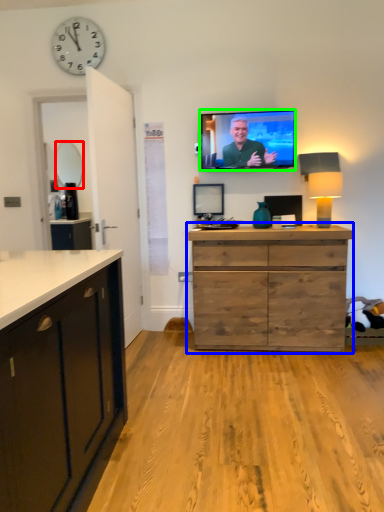
Question: Which is farther away from mirror (highlighted by a red box)? chest of drawers (highlighted by a blue box) or television (highlighted by a green box)?

Choices:
 (A) chest of drawers
 (B) television

Answer: (A)